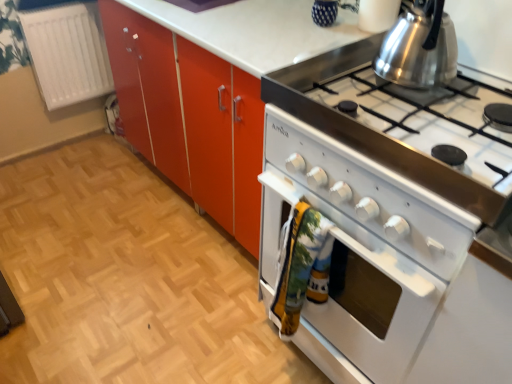
What is the approximate height of white glossy oven at right?

26.54 inches.

The width and height of the screenshot is (512, 384). What are the coordinates of `white glossy oven at right` in the screenshot? It's located at (355, 297).

This screenshot has width=512, height=384. In order to click on white glossy stove at right in this screenshot , I will do (x=373, y=194).

Locate an element on the screen. shiny metallic kettle at upper right is located at coordinates (419, 47).

What is the approximate width of white plastic radiator at left?

4.75 inches.

Locate an element on the screen. This screenshot has height=384, width=512. white glossy oven at right is located at coordinates (355, 297).

Where is `oven on the right of white plastic radiator at left`? The image size is (512, 384). oven on the right of white plastic radiator at left is located at coordinates (355, 297).

Does white glossy oven at right appear on the left side of white plastic radiator at left?

No.

Which of these two, white glossy oven at right or white plastic radiator at left, stands taller?

Standing taller between the two is white glossy oven at right.

From a real-world perspective, between white glossy oven at right and white plastic radiator at left, who is vertically higher?

white plastic radiator at left.

From the image's perspective, is white glossy oven at right on shiny metallic kettle at upper right?

Actually, white glossy oven at right appears below shiny metallic kettle at upper right in the image.

Considering the sizes of objects white glossy oven at right and shiny metallic kettle at upper right in the image provided, who is thinner, white glossy oven at right or shiny metallic kettle at upper right?

Thinner between the two is shiny metallic kettle at upper right.

Is white glossy oven at right at the right side of shiny metallic kettle at upper right?

No, white glossy oven at right is not to the right of shiny metallic kettle at upper right.

Is white glossy oven at right turned away from shiny metallic kettle at upper right?

white glossy oven at right does not have its back to shiny metallic kettle at upper right.

Considering the relative sizes of white glossy oven at right and white glossy oven at lower right in the image provided, is white glossy oven at right bigger than white glossy oven at lower right?

Correct, white glossy oven at right is larger in size than white glossy oven at lower right.

From the image's perspective, is white glossy oven at right on top of white glossy oven at lower right?

Yes, from the image's perspective, white glossy oven at right is on top of white glossy oven at lower right.

Considering the positions of objects white glossy oven at right and white glossy oven at lower right in the image provided, who is more to the left, white glossy oven at right or white glossy oven at lower right?

Positioned to the left is white glossy oven at lower right.

Is white glossy oven at right far from white glossy oven at lower right?

white glossy oven at right is actually quite close to white glossy oven at lower right.

From a real-world perspective, is white glossy oven at lower right under white plastic radiator at left?

Correct, in the physical world, white glossy oven at lower right is lower than white plastic radiator at left.

In the image, there is a white glossy oven at lower right. At what (x,y) coordinates should I click in order to perform the action: click on radiator above it (from the image's perspective). Please return your answer as a coordinate pair (x, y). Looking at the image, I should click on (67, 53).

Is white glossy oven at lower right not inside white plastic radiator at left?

Yes, white glossy oven at lower right is located beyond the bounds of white plastic radiator at left.

Relative to white glossy stove at right, is shiny metallic kettle at upper right in front or behind?

shiny metallic kettle at upper right is positioned farther from the viewer than white glossy stove at right.

From the picture: Considering the sizes of objects shiny metallic kettle at upper right and white glossy stove at right in the image provided, who is wider, shiny metallic kettle at upper right or white glossy stove at right?

white glossy stove at right.

From a real-world perspective, is shiny metallic kettle at upper right physically located above or below white glossy stove at right?

shiny metallic kettle at upper right is situated higher than white glossy stove at right in the real world.

How different are the orientations of shiny metallic kettle at upper right and white glossy stove at right in degrees?

The angle between the facing direction of shiny metallic kettle at upper right and the facing direction of white glossy stove at right is 1.97 degrees.

In terms of width, does white glossy stove at right look wider or thinner when compared to white plastic radiator at left?

Clearly, white glossy stove at right has more width compared to white plastic radiator at left.

From the image's perspective, which object appears higher, white glossy stove at right or white plastic radiator at left?

white plastic radiator at left, from the image's perspective.

Who is bigger, white glossy stove at right or white plastic radiator at left?

Bigger between the two is white glossy stove at right.

Is white glossy stove at right at the left side of white plastic radiator at left?

Incorrect, white glossy stove at right is not on the left side of white plastic radiator at left.

Who is more distant, shiny metallic kettle at upper right or white plastic radiator at left?

white plastic radiator at left is more distant.

Which point is more distant from viewer, (413, 15) or (37, 48)?

The point (37, 48) is farther.

Is shiny metallic kettle at upper right far from white plastic radiator at left?

Indeed, shiny metallic kettle at upper right is not near white plastic radiator at left.

Can you confirm if shiny metallic kettle at upper right is smaller than white plastic radiator at left?

Correct, shiny metallic kettle at upper right occupies less space than white plastic radiator at left.

The image size is (512, 384). Find the location of `radiator above the white glossy oven at right (from the image's perspective)`. radiator above the white glossy oven at right (from the image's perspective) is located at coordinates (67, 53).

The height and width of the screenshot is (384, 512). Find the location of `oven below the shiny metallic kettle at upper right (from a real-world perspective)`. oven below the shiny metallic kettle at upper right (from a real-world perspective) is located at coordinates (355, 297).

Estimate the real-world distances between objects in this image. Which object is further from white glossy oven at right, white glossy stove at right or white plastic radiator at left?

Among the two, white plastic radiator at left is located further to white glossy oven at right.

Considering their positions, is white glossy stove at right positioned closer to white plastic radiator at left than white glossy oven at lower right?

Based on the image, white glossy oven at lower right appears to be nearer to white plastic radiator at left.

Looking at the image, which one is located closer to shiny metallic kettle at upper right, white glossy oven at lower right or white plastic radiator at left?

white glossy oven at lower right is positioned closer to the anchor shiny metallic kettle at upper right.

Consider the image. Based on their spatial positions, is white plastic radiator at left or white glossy oven at right closer to white glossy oven at lower right?

white glossy oven at right is positioned closer to the anchor white glossy oven at lower right.

From the image, which object appears to be nearer to white glossy oven at lower right, shiny metallic kettle at upper right or white plastic radiator at left?

white plastic radiator at left lies closer to white glossy oven at lower right than the other object.

Consider the image. Estimate the real-world distances between objects in this image. Which object is closer to shiny metallic kettle at upper right, white glossy stove at right or white glossy oven at right?

white glossy stove at right is positioned closer to the anchor shiny metallic kettle at upper right.

Based on their spatial positions, is white glossy stove at right or white glossy oven at lower right closer to shiny metallic kettle at upper right?

white glossy stove at right lies closer to shiny metallic kettle at upper right than the other object.

From the picture: Looking at the image, which one is located further to white glossy stove at right, shiny metallic kettle at upper right or white plastic radiator at left?

The object further to white glossy stove at right is white plastic radiator at left.

Identify the location of plain between white plastic radiator at left and white glossy oven at right from left to right. (127, 280).

Identify the location of oven between white plastic radiator at left and shiny metallic kettle at upper right in the horizontal direction. (355, 297).

Where is `plain located between white plastic radiator at left and shiny metallic kettle at upper right in the left-right direction`? This screenshot has width=512, height=384. plain located between white plastic radiator at left and shiny metallic kettle at upper right in the left-right direction is located at coordinates (127, 280).

What are the coordinates of `oven located between white glossy oven at lower right and shiny metallic kettle at upper right in the left-right direction` in the screenshot? It's located at click(355, 297).